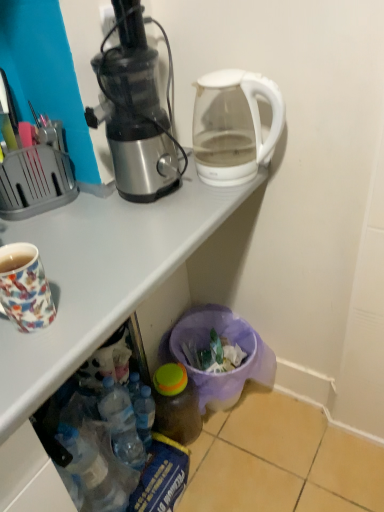
Locate an element on the screen. This screenshot has height=512, width=384. vacant space in between multicolored ceramic mug at left and transparent glass kettle at upper right is located at coordinates (146, 243).